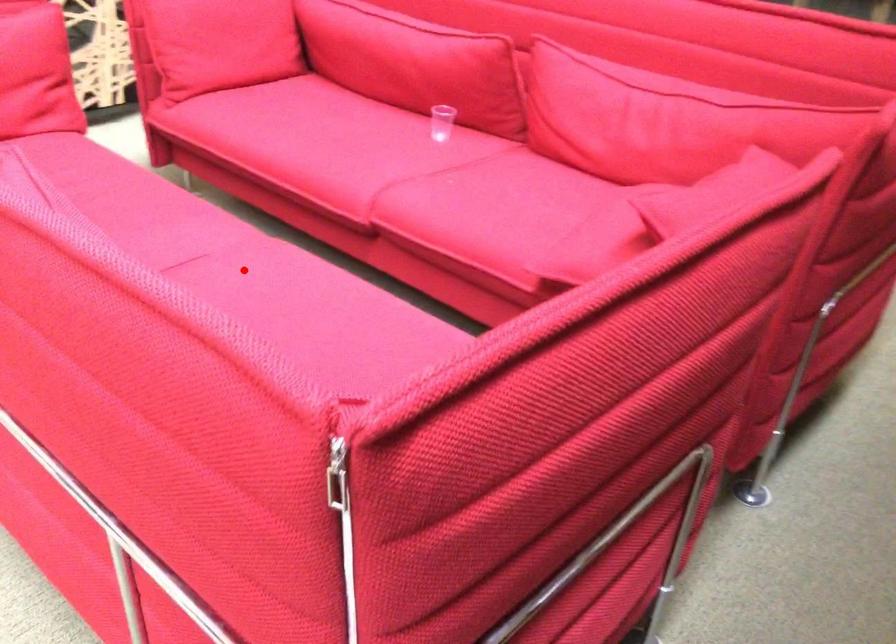
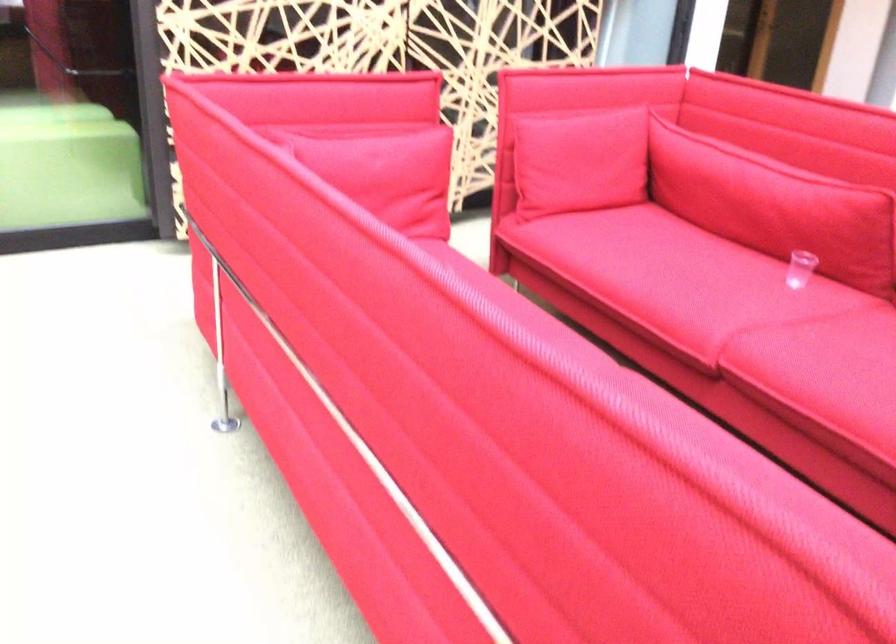
Question: I am providing you with two images of the same scene from different viewpoints. A red point is marked on the first image. At the location where the point appears in image 1, is it still visible in image 2?

Choices:
 (A) Yes
 (B) No

Answer: (B)